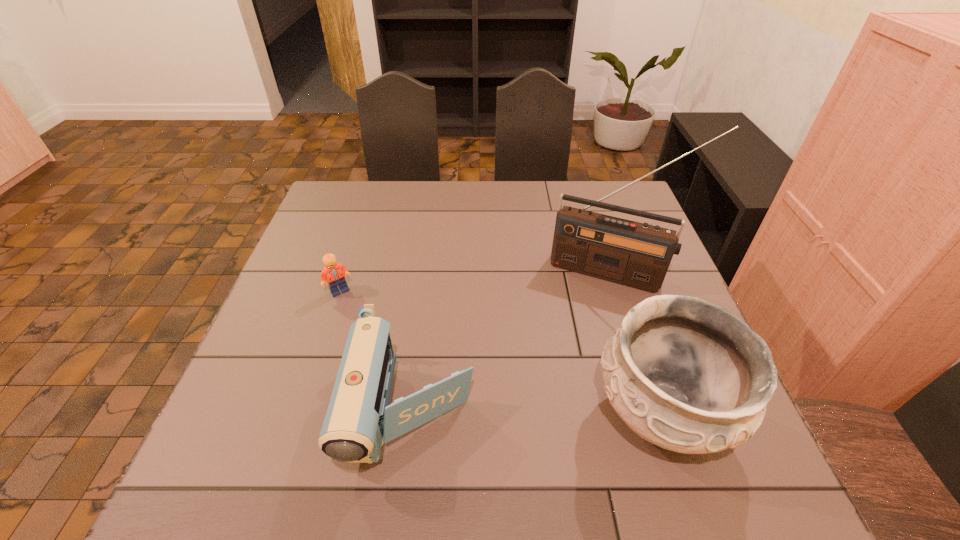
You are a GUI agent. You are given a task and a screenshot of the screen. Output one action in this format:
    pyautogui.click(x=<x>, y=<y>)
    Task: Click on the free space on the desktop that is between the second object from left to right and the second tallest object and is positioned on the front-facing side of the leftmost object
    
    Given the screenshot: What is the action you would take?
    pyautogui.click(x=527, y=413)

Identify the location of free space on the desktop that is between the third object from right to left and the pottery and is positioned on the front-facing side of the radio receiver. (568, 412).